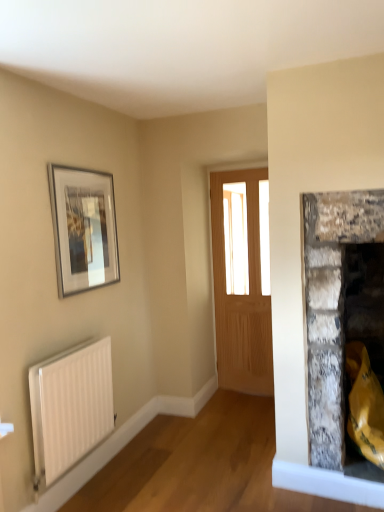
The height and width of the screenshot is (512, 384). Find the location of `light brown wooden door at center`. light brown wooden door at center is located at coordinates (241, 280).

Where is `white matte radiator at lower left`? white matte radiator at lower left is located at coordinates (70, 406).

Is light brown wooden door at center inside white matte radiator at lower left?

No.

Is white matte radiator at lower left not close to light brown wooden door at center?

Yes, white matte radiator at lower left and light brown wooden door at center are located far from each other.

Which is in front, point (108, 400) or point (245, 239)?

The point (108, 400) is in front.

Can you confirm if white matte radiator at lower left is positioned to the right of light brown wooden door at center?

In fact, white matte radiator at lower left is to the left of light brown wooden door at center.

Looking at this image, is silver metallic picture frame at upper left positioned with its back to white matte radiator at lower left?

silver metallic picture frame at upper left does not have its back to white matte radiator at lower left.

Is the position of silver metallic picture frame at upper left less distant than that of white matte radiator at lower left?

No, the depth of silver metallic picture frame at upper left is greater than that of white matte radiator at lower left.

Is silver metallic picture frame at upper left positioned beyond the bounds of white matte radiator at lower left?

Yes, silver metallic picture frame at upper left is located beyond the bounds of white matte radiator at lower left.

Which point is more forward, (67, 274) or (41, 409)?

Point (41, 409)

Can you confirm if light brown wooden door at center is smaller than white matte radiator at lower left?

Incorrect, light brown wooden door at center is not smaller in size than white matte radiator at lower left.

Would you consider light brown wooden door at center to be distant from white matte radiator at lower left?

Indeed, light brown wooden door at center is not near white matte radiator at lower left.

Which of these two, light brown wooden door at center or white matte radiator at lower left, is wider?

With larger width is light brown wooden door at center.

Is white matte radiator at lower left surrounded by light brown wooden door at center?

No, white matte radiator at lower left is not surrounded by light brown wooden door at center.

Is light brown wooden door at center wider than silver metallic picture frame at upper left?

Correct, the width of light brown wooden door at center exceeds that of silver metallic picture frame at upper left.

Could you measure the distance between light brown wooden door at center and silver metallic picture frame at upper left?

A distance of 4.40 feet exists between light brown wooden door at center and silver metallic picture frame at upper left.

Visually, is light brown wooden door at center positioned to the left or to the right of silver metallic picture frame at upper left?

light brown wooden door at center is positioned on silver metallic picture frame at upper left's right side.

I want to click on picture frame above the light brown wooden door at center (from a real-world perspective), so click(x=83, y=228).

From a real-world perspective, is white matte radiator at lower left physically located above or below silver metallic picture frame at upper left?

From a real-world perspective, white matte radiator at lower left is physically below silver metallic picture frame at upper left.

Considering the positions of objects white matte radiator at lower left and silver metallic picture frame at upper left in the image provided, who is more to the left, white matte radiator at lower left or silver metallic picture frame at upper left?

white matte radiator at lower left is more to the left.

Can you tell me how much white matte radiator at lower left and silver metallic picture frame at upper left differ in facing direction?

They differ by 1.56 degrees in their facing directions.

Is white matte radiator at lower left not near silver metallic picture frame at upper left?

No.

Who is shorter, silver metallic picture frame at upper left or light brown wooden door at center?

silver metallic picture frame at upper left.

Is the position of silver metallic picture frame at upper left less distant than that of light brown wooden door at center?

Yes, the depth of silver metallic picture frame at upper left is less than that of light brown wooden door at center.

Is silver metallic picture frame at upper left turned away from light brown wooden door at center?

No, silver metallic picture frame at upper left's orientation is not away from light brown wooden door at center.

Is point (62, 297) closer to camera compared to point (242, 309)?

Yes.

In order to click on window that appears above the white matte radiator at lower left (from the image's perspective) in this screenshot , I will do `click(241, 280)`.

Image resolution: width=384 pixels, height=512 pixels. I want to click on radiator in front of the silver metallic picture frame at upper left, so click(x=70, y=406).

Looking at this image, which object lies further to the anchor point white matte radiator at lower left, silver metallic picture frame at upper left or light brown wooden door at center?

The object further to white matte radiator at lower left is light brown wooden door at center.

Estimate the real-world distances between objects in this image. Which object is further from silver metallic picture frame at upper left, light brown wooden door at center or white matte radiator at lower left?

Based on the image, light brown wooden door at center appears to be further to silver metallic picture frame at upper left.

When comparing their distances from silver metallic picture frame at upper left, does white matte radiator at lower left or light brown wooden door at center seem further?

The object further to silver metallic picture frame at upper left is light brown wooden door at center.

Considering their positions, is white matte radiator at lower left positioned further to light brown wooden door at center than silver metallic picture frame at upper left?

white matte radiator at lower left is positioned further to the anchor light brown wooden door at center.

Looking at this image, which object lies further to the anchor point light brown wooden door at center, silver metallic picture frame at upper left or white matte radiator at lower left?

The object further to light brown wooden door at center is white matte radiator at lower left.

Estimate the real-world distances between objects in this image. Which object is further from white matte radiator at lower left, light brown wooden door at center or silver metallic picture frame at upper left?

Based on the image, light brown wooden door at center appears to be further to white matte radiator at lower left.

Image resolution: width=384 pixels, height=512 pixels. In order to click on picture frame located between white matte radiator at lower left and light brown wooden door at center in the depth direction in this screenshot , I will do `click(83, 228)`.